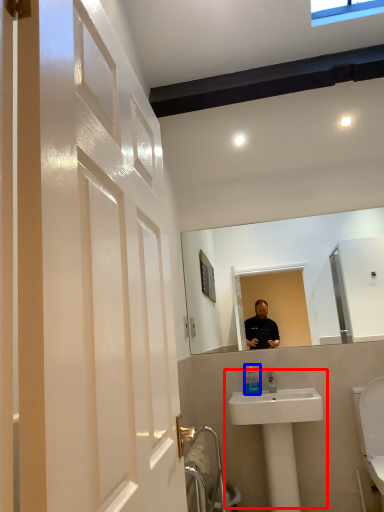
Question: Which of the following is the farthest to the observer, sink (highlighted by a red box) or toiletry (highlighted by a blue box)?

Choices:
 (A) sink
 (B) toiletry

Answer: (B)